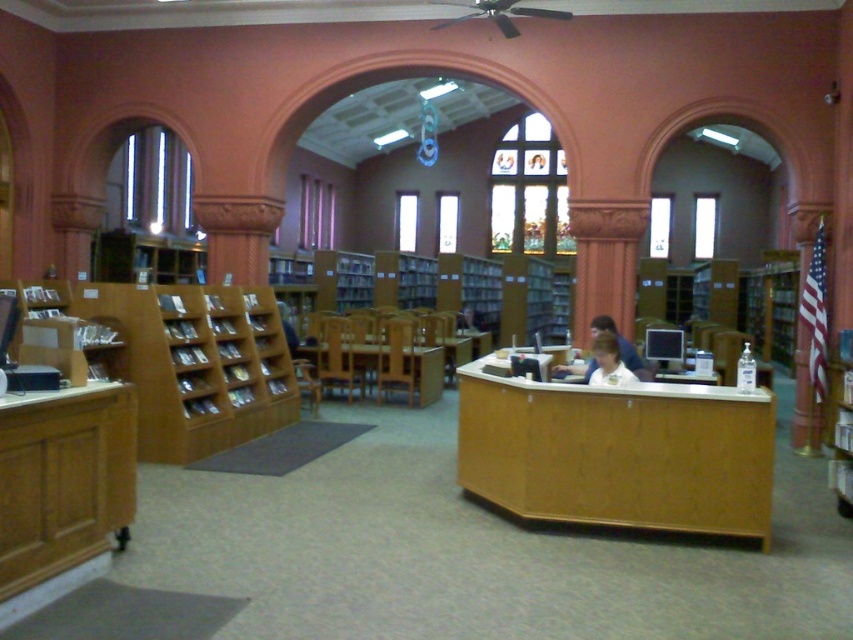
You are standing in the library and want to move from the wooden desk at center to the wooden bookshelf at right. Which direction should you move to reach the bookshelf?

You should move to the right to reach the wooden bookshelf at right since the wooden desk at center is to the left of it.

You are a visitor in the library and see the wooden table at center and the white shirt at center. Which object is closer to the ceiling?

The white shirt at center is closer to the ceiling because the wooden table at center is positioned under it.